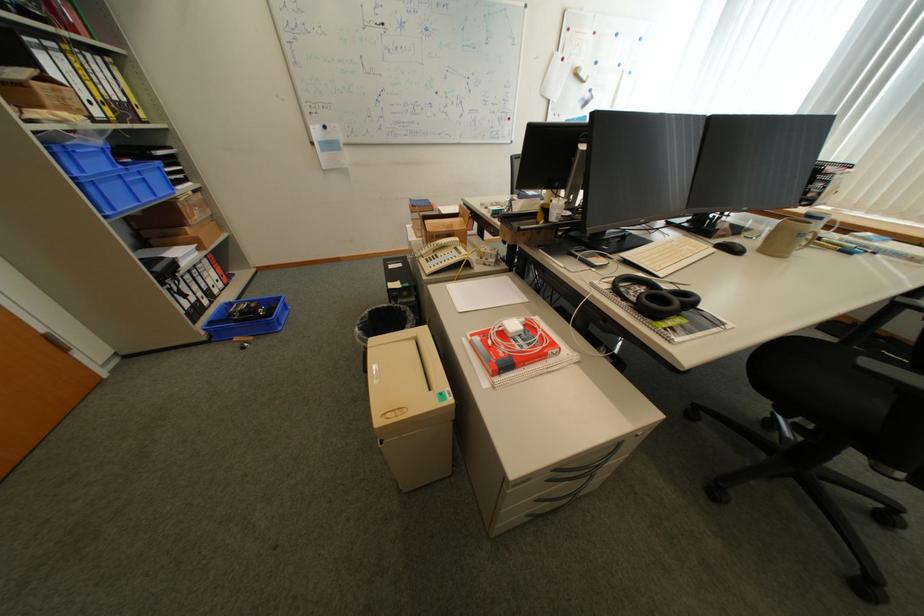
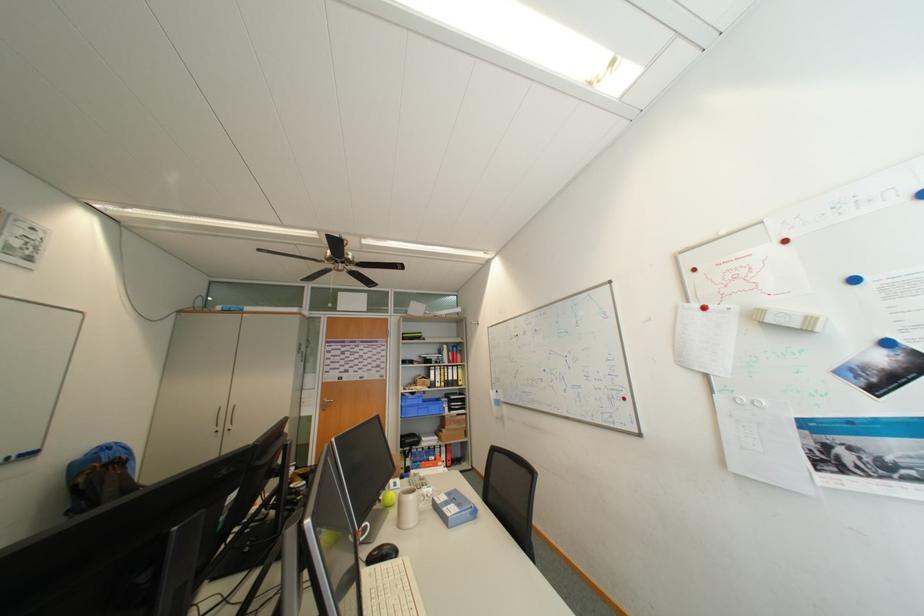
Find the pixel in the second image that matches the point at 590,75 in the first image.

(777, 322)